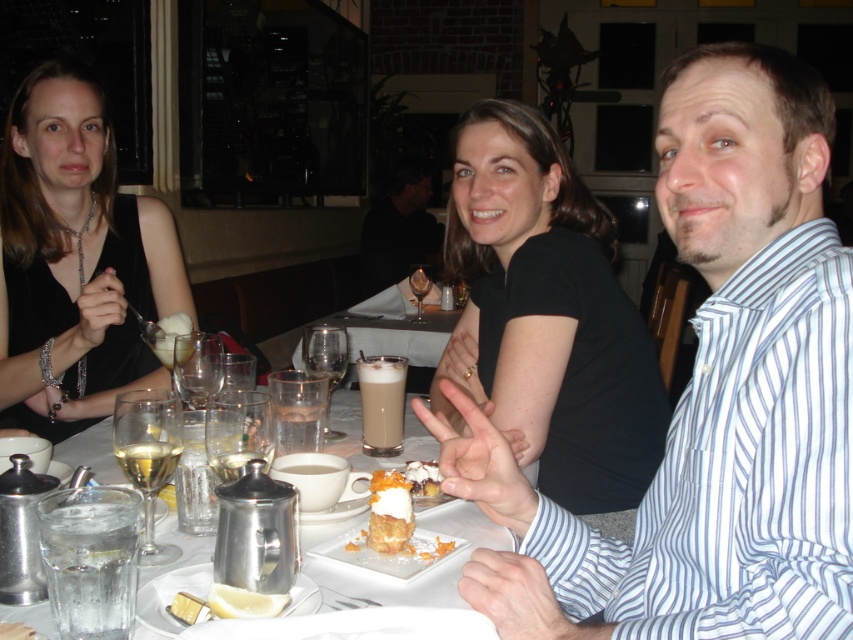
Question: Observing the image, what is the correct spatial positioning of translucent glass wine at table center in reference to yellow matte lemon at lower left?

Choices:
 (A) right
 (B) left

Answer: (B)

Question: In this image, where is white porcelain plate at center located relative to white creamy dessert at center?

Choices:
 (A) right
 (B) left

Answer: (A)

Question: Does golden crumbly cake at center have a larger size compared to white creamy dessert at center?

Choices:
 (A) yes
 (B) no

Answer: (B)

Question: Among these points, which one is farthest from the camera?

Choices:
 (A) (457, 516)
 (B) (477, 205)
 (C) (149, 472)

Answer: (B)

Question: Which object is the closest to the spongy yellow cake at center?

Choices:
 (A) light brown frothy beverage at center
 (B) yellow matte lemon at lower left
 (C) golden crumbly cake at center
 (D) powdered white cake at center

Answer: (D)

Question: Which point is closer to the camera?

Choices:
 (A) (444, 513)
 (B) (413, 515)

Answer: (B)